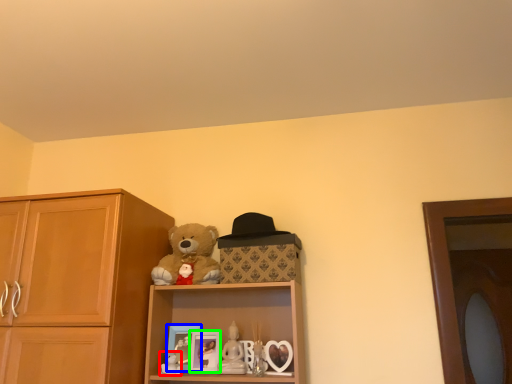
Question: Which is farther away from toy (highlighted by a red box)? picture frame (highlighted by a blue box) or picture frame (highlighted by a green box)?

Choices:
 (A) picture frame
 (B) picture frame

Answer: (B)